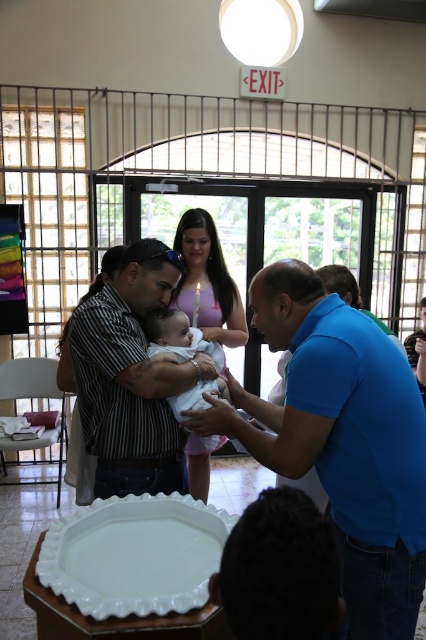
Looking at this image, you are a photographer standing in the back of the room. You want to take a photo of the striped shirt at center and the white soft fabric baby at center. Which one will appear larger in your photo?

The striped shirt at center will appear larger in the photo because it is closer to the viewer than the white soft fabric baby at center.